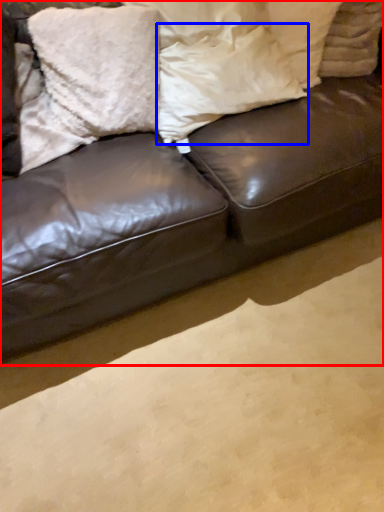
Question: Which of the following is the closest to the observer, studio couch (highlighted by a red box) or pillow (highlighted by a blue box)?

Choices:
 (A) studio couch
 (B) pillow

Answer: (A)